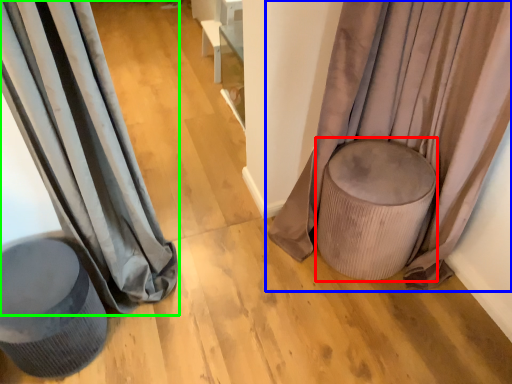
Question: Considering the real-world distances, which object is farthest from music stool (highlighted by a red box)? curtain (highlighted by a blue box) or curtain (highlighted by a green box)?

Choices:
 (A) curtain
 (B) curtain

Answer: (B)